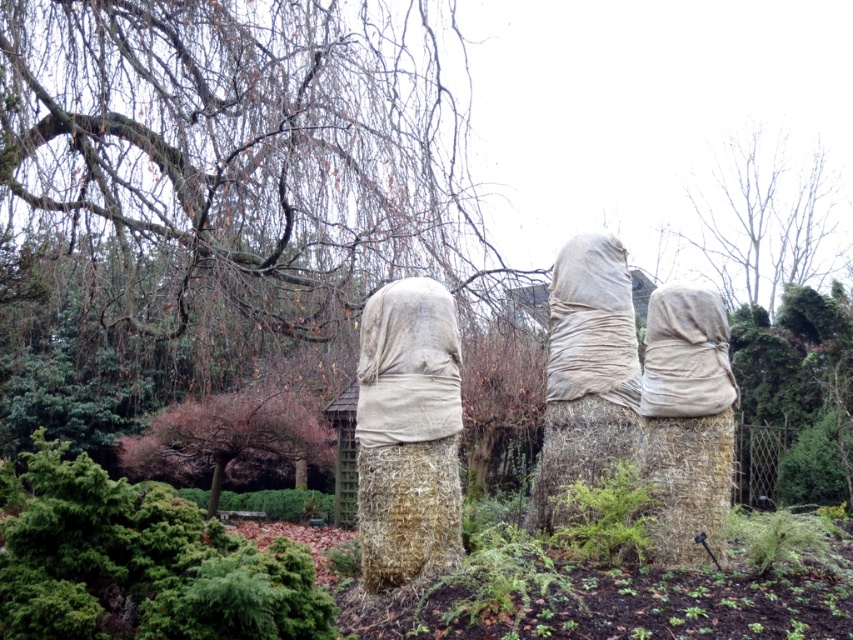
Question: Which object is the closest to the burlap-covered figure at center?

Choices:
 (A) bare branches at upper center
 (B) brown mossy tree trunk at upper left

Answer: (B)

Question: Among these objects, which one is farthest from the camera?

Choices:
 (A) matte beige fabric at right
 (B) bare branches at upper center
 (C) brown mossy tree trunk at upper left
 (D) matte beige fabric at center

Answer: (B)

Question: Among these objects, which one is nearest to the camera?

Choices:
 (A) matte beige fabric at center
 (B) matte beige fabric at right

Answer: (B)

Question: Is matte beige fabric at center to the right of matte beige fabric at right from the viewer's perspective?

Choices:
 (A) no
 (B) yes

Answer: (A)

Question: Does brown mossy tree trunk at upper left come in front of bare branches at upper center?

Choices:
 (A) no
 (B) yes

Answer: (B)

Question: Is brown mossy tree trunk at upper left behind matte beige fabric at right?

Choices:
 (A) yes
 (B) no

Answer: (A)